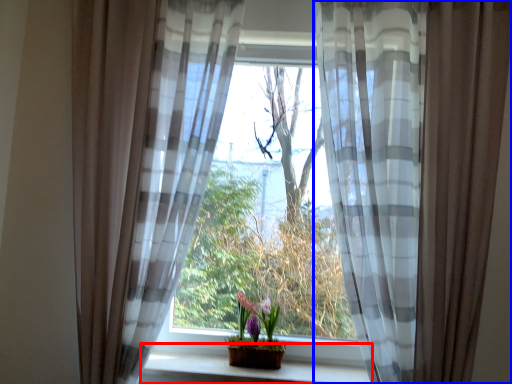
Question: Which object appears closest to the camera in this image, window sill (highlighted by a red box) or curtain (highlighted by a blue box)?

Choices:
 (A) window sill
 (B) curtain

Answer: (B)